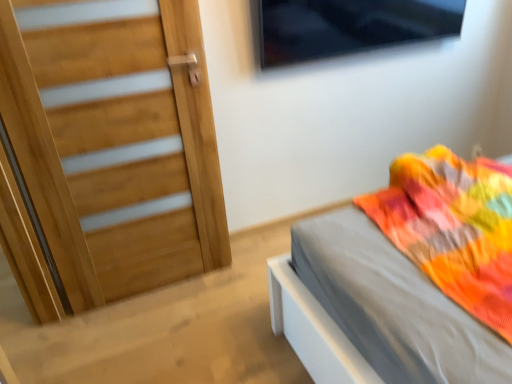
Question: Considering the relative sizes of transparent glass window at upper center and natural wood door at left in the image provided, is transparent glass window at upper center shorter than natural wood door at left?

Choices:
 (A) no
 (B) yes

Answer: (B)

Question: Is the position of transparent glass window at upper center more distant than that of natural wood door at left?

Choices:
 (A) no
 (B) yes

Answer: (B)

Question: Is transparent glass window at upper center at the right side of natural wood door at left?

Choices:
 (A) no
 (B) yes

Answer: (B)

Question: Is transparent glass window at upper center beside natural wood door at left?

Choices:
 (A) yes
 (B) no

Answer: (B)

Question: Does transparent glass window at upper center have a greater height compared to natural wood door at left?

Choices:
 (A) yes
 (B) no

Answer: (B)

Question: Considering the positions of matte gray bed at right and natural wood door at left in the image, is matte gray bed at right wider or thinner than natural wood door at left?

Choices:
 (A) thin
 (B) wide

Answer: (B)

Question: From their relative heights in the image, would you say matte gray bed at right is taller or shorter than natural wood door at left?

Choices:
 (A) short
 (B) tall

Answer: (A)

Question: Considering the positions of point (321, 357) and point (181, 254), is point (321, 357) closer or farther from the camera than point (181, 254)?

Choices:
 (A) farther
 (B) closer

Answer: (B)

Question: In the image, is matte gray bed at right positioned in front of or behind natural wood door at left?

Choices:
 (A) behind
 (B) front

Answer: (A)

Question: Is natural wood door at left bigger or smaller than transparent glass window at upper center?

Choices:
 (A) small
 (B) big

Answer: (B)

Question: Is point (73, 46) positioned closer to the camera than point (348, 43)?

Choices:
 (A) closer
 (B) farther

Answer: (A)

Question: Considering the positions of natural wood door at left and transparent glass window at upper center in the image, is natural wood door at left taller or shorter than transparent glass window at upper center?

Choices:
 (A) tall
 (B) short

Answer: (A)

Question: In terms of width, does natural wood door at left look wider or thinner when compared to transparent glass window at upper center?

Choices:
 (A) thin
 (B) wide

Answer: (A)

Question: Is matte gray bed at right inside the boundaries of transparent glass window at upper center, or outside?

Choices:
 (A) outside
 (B) inside

Answer: (A)

Question: In the image, is matte gray bed at right on the left side or the right side of transparent glass window at upper center?

Choices:
 (A) left
 (B) right

Answer: (A)